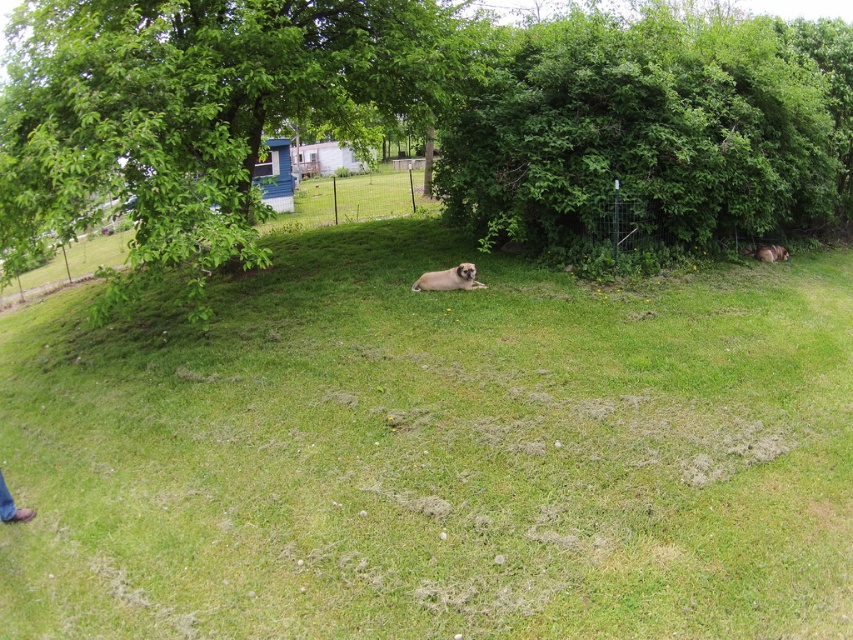
Who is shorter, green grassy at center or brown furry dog at lower right?

Standing shorter between the two is brown furry dog at lower right.

Who is more forward, (682, 413) or (776, 252)?

Point (682, 413) is more forward.

Identify the location of green grassy at center. (436, 452).

Does brown furry dog at center appear over brown leather shoes at lower left?

Correct, brown furry dog at center is located above brown leather shoes at lower left.

Who is taller, brown furry dog at center or brown leather shoes at lower left?

brown furry dog at center

The height and width of the screenshot is (640, 853). Describe the element at coordinates (448, 280) in the screenshot. I see `brown furry dog at center` at that location.

Image resolution: width=853 pixels, height=640 pixels. In order to click on brown furry dog at center in this screenshot , I will do `click(448, 280)`.

Can you confirm if green grassy at center is positioned to the left of green leafy bush at center?

Yes, green grassy at center is to the left of green leafy bush at center.

Identify the location of green grassy at center. (436, 452).

Identify the location of green grassy at center. The image size is (853, 640). (436, 452).